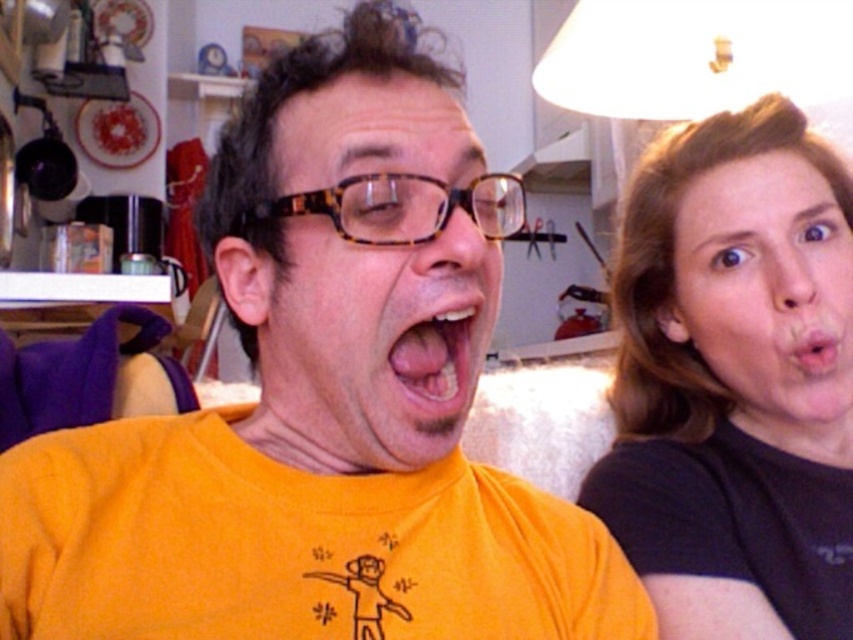
Is black matte hair at upper right taller than matte skin face at right?

Correct, black matte hair at upper right is much taller as matte skin face at right.

Image resolution: width=853 pixels, height=640 pixels. What do you see at coordinates (732, 381) in the screenshot?
I see `black matte hair at upper right` at bounding box center [732, 381].

Where is `black matte hair at upper right`? black matte hair at upper right is located at coordinates (732, 381).

Can you confirm if orange matte/yellow t-shirt at center is smaller than pink glossy tongue at center?

Incorrect, orange matte/yellow t-shirt at center is not smaller in size than pink glossy tongue at center.

Who is more distant from viewer, [253,413] or [419,385]?

The point [253,413] is more distant.

Which is behind, point (451, 140) or point (463, 403)?

The point (451, 140) is more distant.

You are a GUI agent. You are given a task and a screenshot of the screen. Output one action in this format:
    pyautogui.click(x=<x>, y=<y>)
    Task: Click on the orange matte/yellow t-shirt at center
    
    Given the screenshot: What is the action you would take?
    pyautogui.click(x=364, y=342)

Based on the photo, is black matte hair at upper right to the right of pink glossy tongue at center from the viewer's perspective?

Yes, black matte hair at upper right is to the right of pink glossy tongue at center.

Where is `black matte hair at upper right`? The image size is (853, 640). black matte hair at upper right is located at coordinates (732, 381).